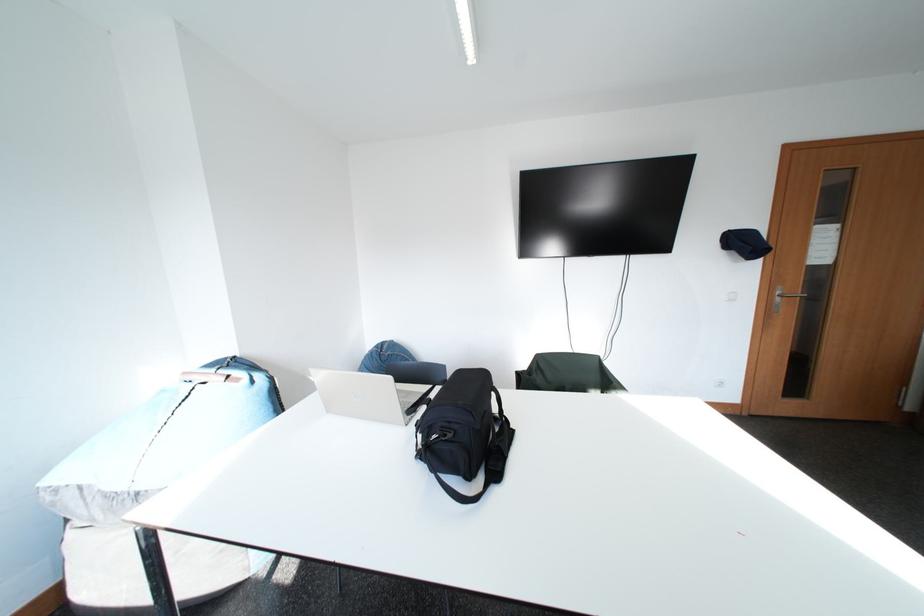
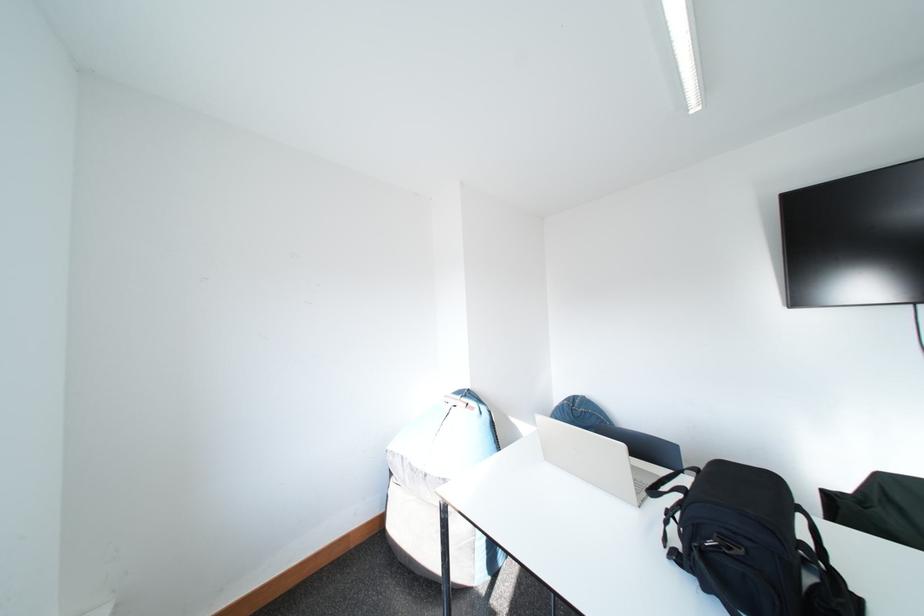
The point at (456, 439) is marked in the first image. Where is the corresponding point in the second image?

(743, 552)